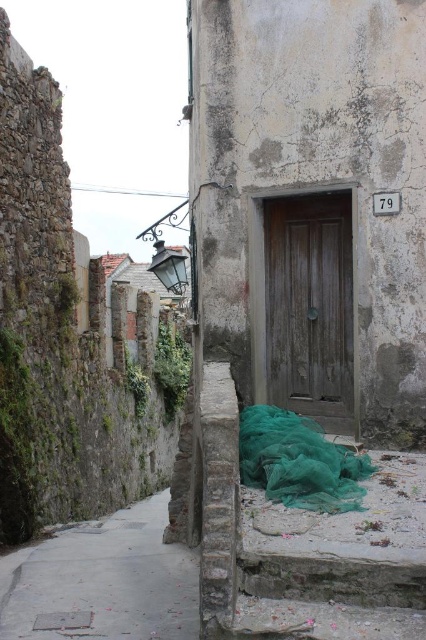
You are a delivery person trying to deliver a package to the wooden door at center. You have a cart that is 2 meters tall. Can you safely pass under the concrete sidewalk at lower left without hitting your cart?

The concrete sidewalk at lower left has a lesser height compared to wooden door at center. Since the sidewalk is lower, the cart that is 2 meters tall may hit the sidewalk if it is too low. However, the description only states the sidewalk is shorter in height than the door, but does not provide exact measurements. Without knowing the exact height of the sidewalk, it is uncertain if the cart will fit. Please check the actual height before proceeding.